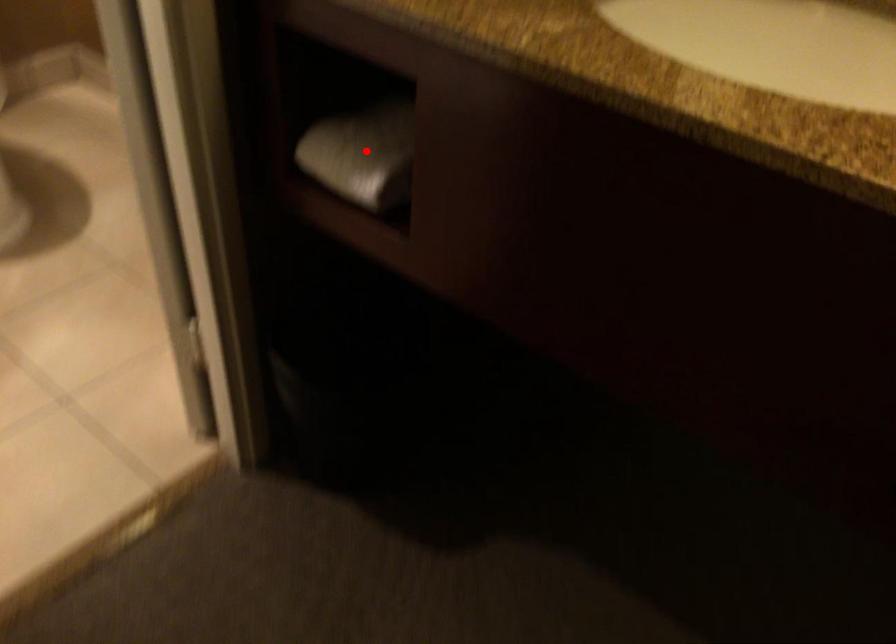
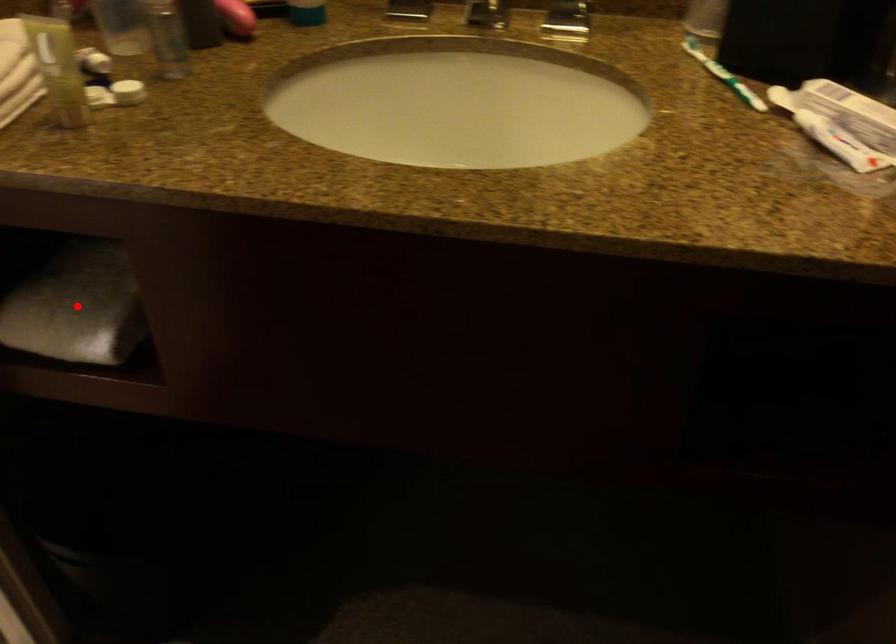
Looking at this image, I am providing you with two images of the same scene from different viewpoints. A red point is marked on the first image and another point is marked on the second image. Are the points marked in image1 and image2 representing the same 3D position?

Yes